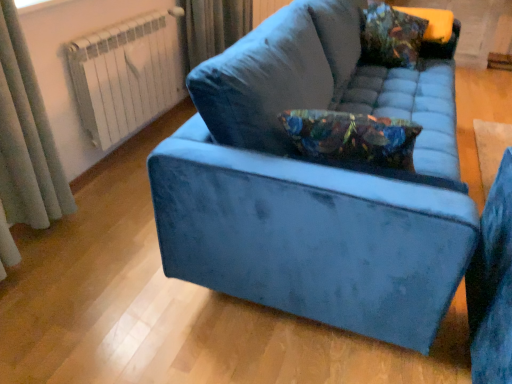
The width and height of the screenshot is (512, 384). I want to click on free space to the right of gray fabric curtain at left, so click(x=100, y=225).